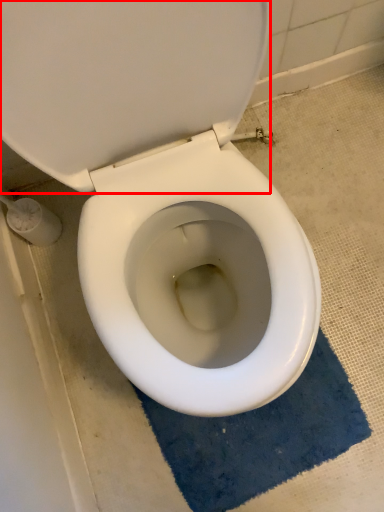
Question: From the image's perspective, considering the relative positions of back (annotated by the red box) and bath mat in the image provided, where is back (annotated by the red box) located with respect to the staircase?

Choices:
 (A) below
 (B) above

Answer: (B)